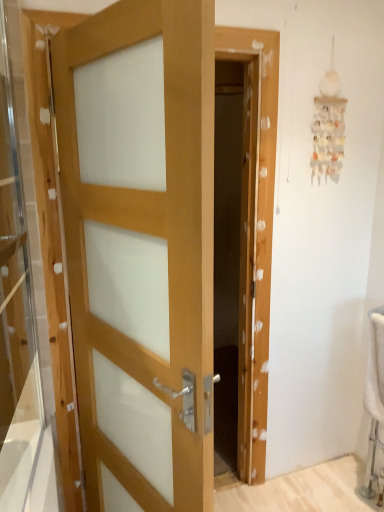
The width and height of the screenshot is (384, 512). What do you see at coordinates (21, 301) in the screenshot?
I see `transparent glass door at left` at bounding box center [21, 301].

You are a GUI agent. You are given a task and a screenshot of the screen. Output one action in this format:
    pyautogui.click(x=<x>, y=<y>)
    Task: Click on the transparent glass door at left
    The image size is (384, 512).
    Given the screenshot: What is the action you would take?
    pyautogui.click(x=21, y=301)

Describe the element at coordinates (160, 246) in the screenshot. I see `light wood door at center` at that location.

Find the location of `light wood door at center`. light wood door at center is located at coordinates (160, 246).

Where is `transparent glass door at left`? transparent glass door at left is located at coordinates (21, 301).

Does transparent glass door at left appear on the right side of light wood door at center?

In fact, transparent glass door at left is to the left of light wood door at center.

Is transparent glass door at left behind light wood door at center?

No.

Between point (61, 494) and point (277, 81), which one is positioned in front?

The point (61, 494) is more forward.

From the image's perspective, is transparent glass door at left over light wood door at center?

Indeed, from the image's perspective, transparent glass door at left is shown above light wood door at center.

From the picture: From a real-world perspective, is transparent glass door at left physically above light wood door at center?

Yes, from a real-world perspective, transparent glass door at left is above light wood door at center.

Is transparent glass door at left wider or thinner than light wood door at center?

Clearly, transparent glass door at left has less width compared to light wood door at center.

Who is shorter, transparent glass door at left or light wood door at center?

With less height is transparent glass door at left.

Between transparent glass door at left and light wood door at center, which one has larger size?

light wood door at center.

Is light wood door at center surrounded by transparent glass door at left?

No, transparent glass door at left does not contain light wood door at center.

Is transparent glass door at left next to light wood door at center and touching it?

No, transparent glass door at left is not beside light wood door at center.

Is transparent glass door at left oriented towards light wood door at center?

Yes, transparent glass door at left is facing light wood door at center.

Where is `door to the right of transparent glass door at left`? This screenshot has height=512, width=384. door to the right of transparent glass door at left is located at coordinates (160, 246).

Which object is positioned more to the left, light wood door at center or transparent glass door at left?

transparent glass door at left.

Which object is closer to the camera taking this photo, light wood door at center or transparent glass door at left?

transparent glass door at left is in front.

Which is in front, point (256, 166) or point (17, 231)?

The point (17, 231) is closer to the camera.

From the image's perspective, is light wood door at center above or below transparent glass door at left?

light wood door at center is below transparent glass door at left.

From a real-world perspective, relative to transparent glass door at left, is light wood door at center vertically above or below?

In terms of real-world spatial position, light wood door at center is below transparent glass door at left.

Based on the photo, which of these two, light wood door at center or transparent glass door at left, is wider?

With larger width is light wood door at center.

Can you confirm if light wood door at center is taller than transparent glass door at left?

Yes, light wood door at center is taller than transparent glass door at left.

In terms of size, does light wood door at center appear bigger or smaller than transparent glass door at left?

In the image, light wood door at center appears to be larger than transparent glass door at left.

Is light wood door at center spatially inside transparent glass door at left, or outside of it?

light wood door at center is outside transparent glass door at left.

Is light wood door at center next to transparent glass door at left and touching it?

There is a gap between light wood door at center and transparent glass door at left.

Is light wood door at center facing away from transparent glass door at left?

Yes, light wood door at center's orientation is away from transparent glass door at left.

How different are the orientations of light wood door at center and transparent glass door at left in degrees?

light wood door at center and transparent glass door at left are facing 27.4 degrees away from each other.

How distant is light wood door at center from transparent glass door at left?

light wood door at center is 12.81 inches from transparent glass door at left.

Locate an element on the screen. This screenshot has width=384, height=512. glass door above the light wood door at center (from the image's perspective) is located at coordinates (21, 301).

This screenshot has width=384, height=512. What are the coordinates of `glass door above the light wood door at center (from a real-world perspective)` in the screenshot? It's located at (21, 301).

The width and height of the screenshot is (384, 512). Find the location of `glass door in front of the light wood door at center`. glass door in front of the light wood door at center is located at coordinates (21, 301).